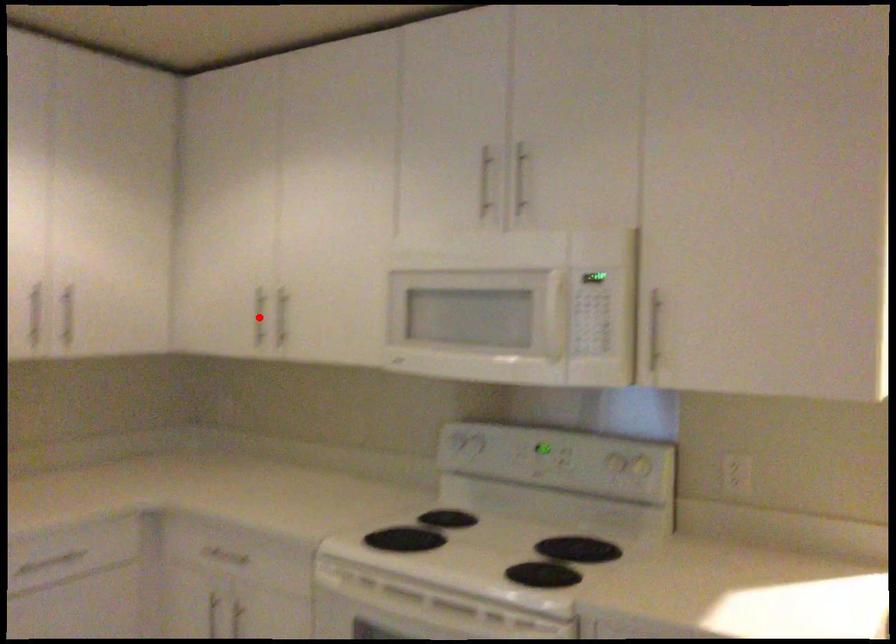
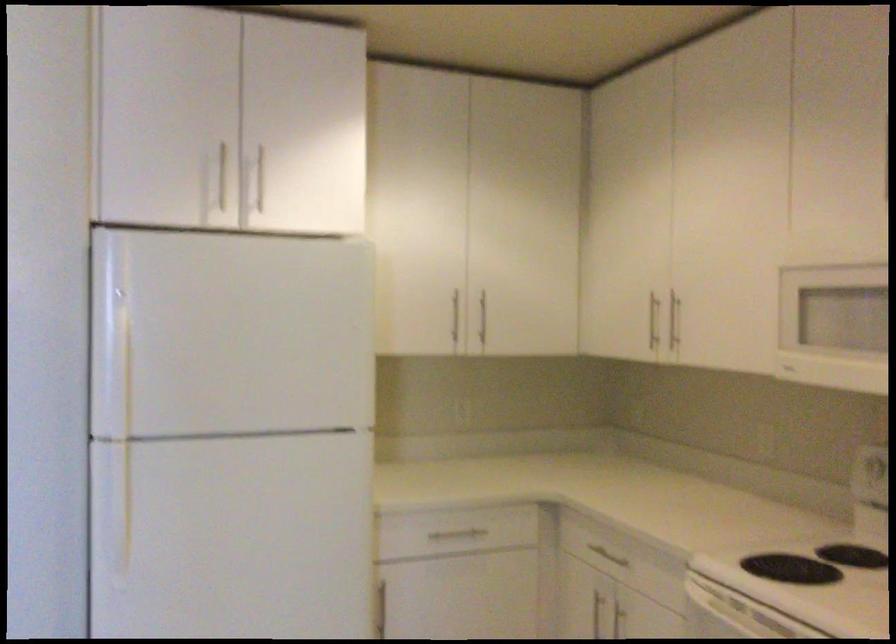
Question: I am providing you with two images of the same scene from different viewpoints. A red point is marked on the first image. Is the red point's position out of view in image 2?

Choices:
 (A) Yes
 (B) No

Answer: (B)